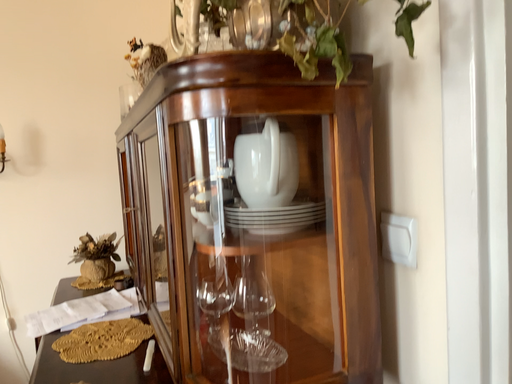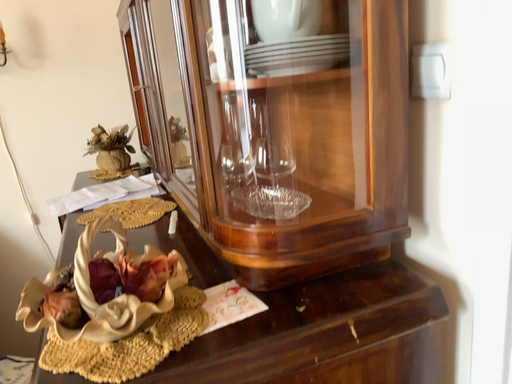
Question: Which way did the camera rotate in the video?

Choices:
 (A) rotated downward
 (B) rotated upward

Answer: (A)